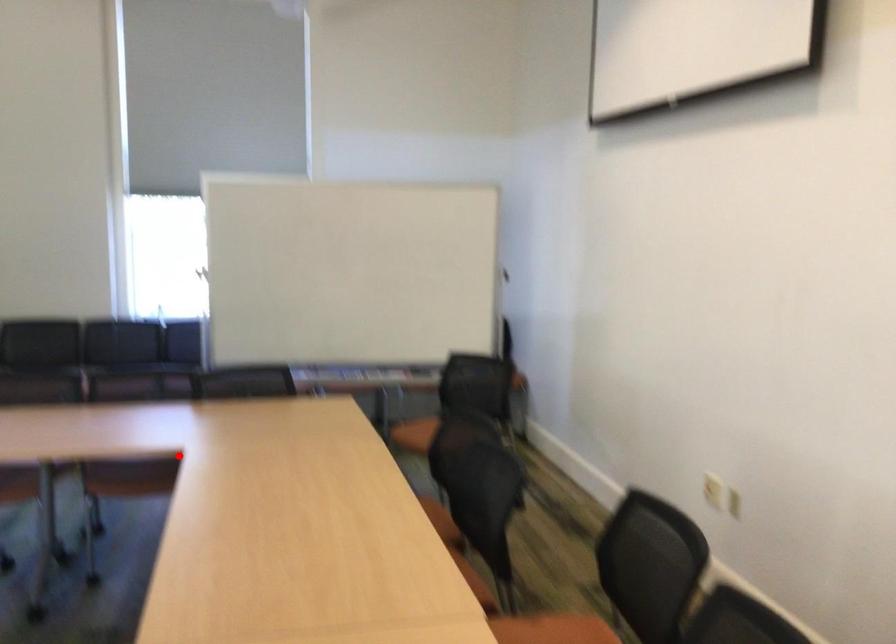
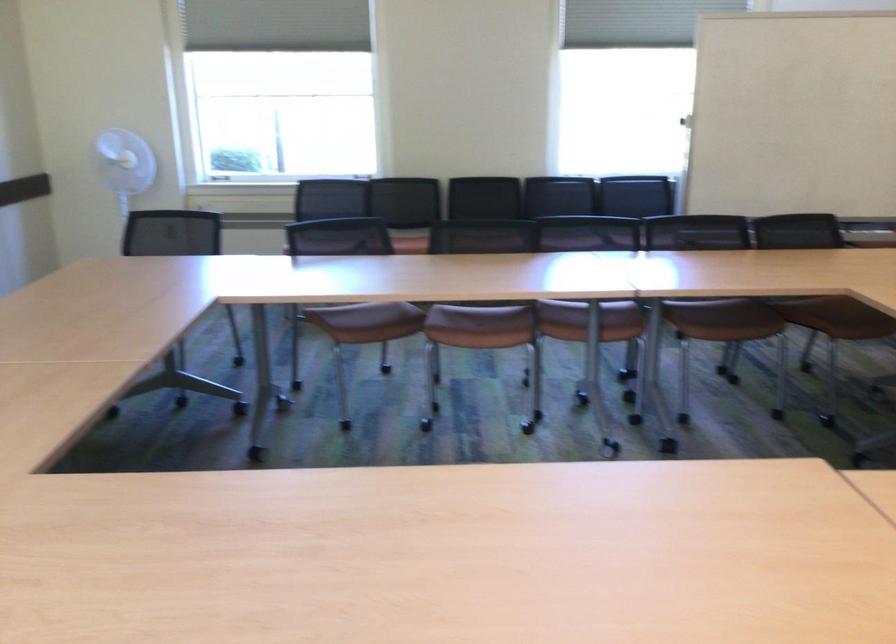
Question: I am providing you with two images of the same scene from different viewpoints. A red point is marked on the first image. Can you still see the location of the red point in image 2?

Choices:
 (A) Yes
 (B) No

Answer: (A)